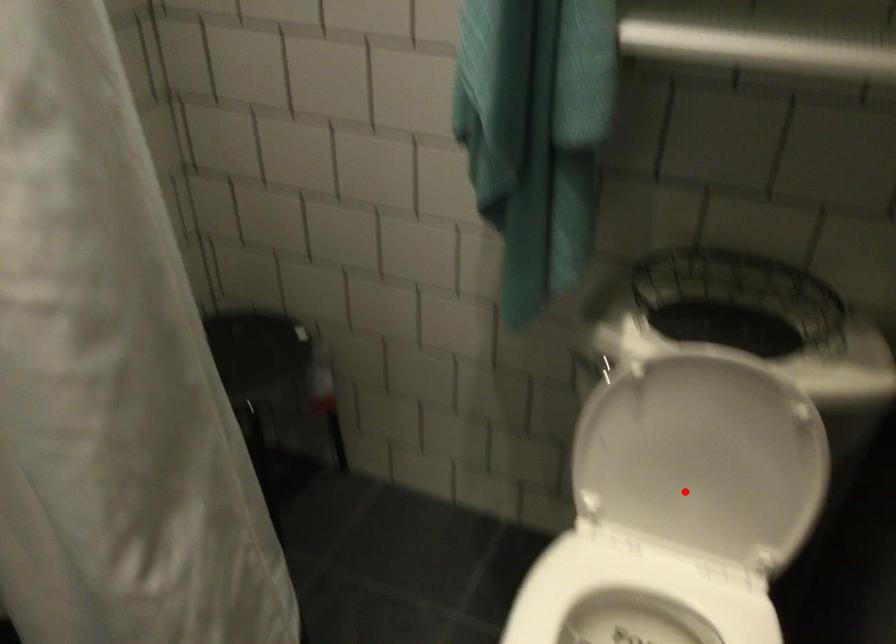
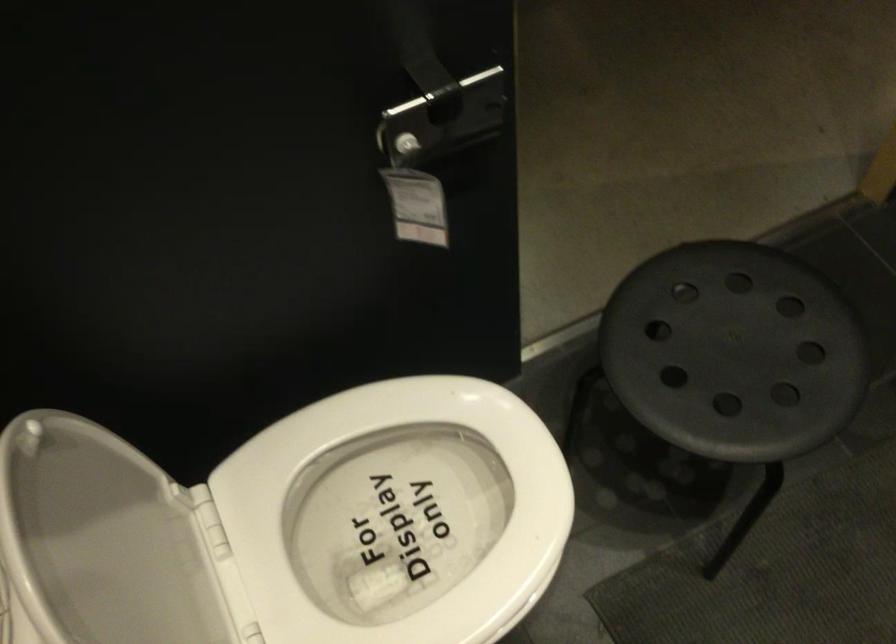
Question: I am providing you with two images of the same scene from different viewpoints. In image1, a red point is highlighted. Considering the same 3D point in image2, which of the following is correct?

Choices:
 (A) It is closer
 (B) It is farther

Answer: (A)